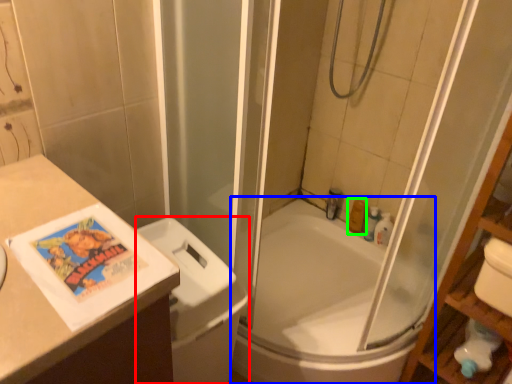
Question: Considering the real-world distances, which object is farthest from toilet bowl (highlighted by a red box)? bathtub (highlighted by a blue box) or toiletry (highlighted by a green box)?

Choices:
 (A) bathtub
 (B) toiletry

Answer: (B)